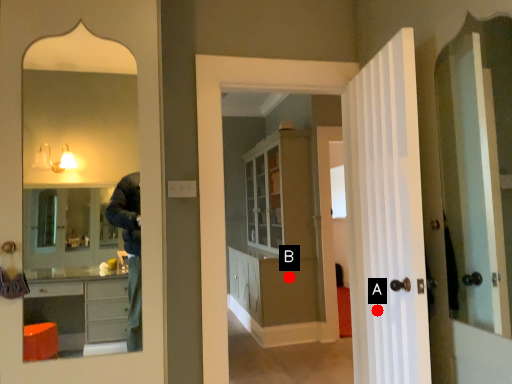
Question: Two points are circled on the image, labeled by A and B beside each circle. Which point appears closest to the camera in this image?

Choices:
 (A) A is closer
 (B) B is closer

Answer: (A)